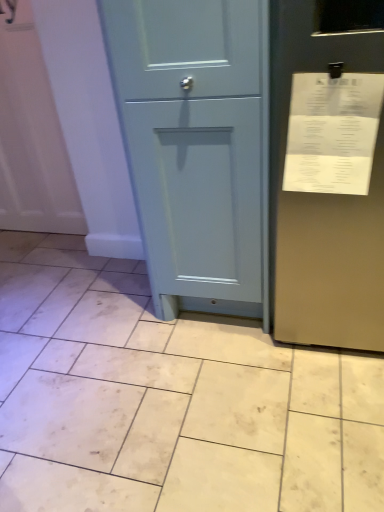
What do you see at coordinates (170, 402) in the screenshot? I see `beige matte tile at center, the 1th ceramic tile from the bottom` at bounding box center [170, 402].

Where is `white glossy tile at lower left, acting as the second ceramic tile starting from the bottom`? white glossy tile at lower left, acting as the second ceramic tile starting from the bottom is located at coordinates (18, 244).

Looking at this image, considering the relative sizes of white paper receipt at upper right and matte blue cabinet at center in the image provided, is white paper receipt at upper right smaller than matte blue cabinet at center?

Correct, white paper receipt at upper right occupies less space than matte blue cabinet at center.

From a real-world perspective, is white paper receipt at upper right physically above matte blue cabinet at center?

Yes, from a real-world perspective, white paper receipt at upper right is above matte blue cabinet at center.

Measure the distance between white paper receipt at upper right and matte blue cabinet at center.

A distance of 30.82 centimeters exists between white paper receipt at upper right and matte blue cabinet at center.

From the picture: Is white paper receipt at upper right far away from matte blue cabinet at center?

That's not correct — white paper receipt at upper right is a little close to matte blue cabinet at center.

Between point (291, 499) and point (133, 57), which one is positioned in front?

Positioned in front is point (291, 499).

Identify the location of door behind the beige matte tile at center, the 1th ceramic tile from the bottom. (197, 145).

Is beige matte tile at center, the 1th ceramic tile from the bottom, inside or outside of matte blue cabinet at center?

beige matte tile at center, the 1th ceramic tile from the bottom, is located beyond the bounds of matte blue cabinet at center.

From a real-world perspective, is beige matte tile at center, the 1th ceramic tile from the bottom, physically above matte blue cabinet at center?

Incorrect, from a real-world perspective, beige matte tile at center, the 1th ceramic tile from the bottom, is lower than matte blue cabinet at center.

From the image's perspective, which is below, matte blue cabinet at center or white glossy tile at lower left, acting as the second ceramic tile starting from the bottom?

white glossy tile at lower left, acting as the second ceramic tile starting from the bottom, is shown below in the image.

What's the angular difference between matte blue cabinet at center and white glossy tile at lower left, acting as the second ceramic tile starting from the bottom,'s facing directions?

The angular difference between matte blue cabinet at center and white glossy tile at lower left, acting as the second ceramic tile starting from the bottom, is 0.049 degrees.

Choose the correct answer: Is matte blue cabinet at center inside white glossy tile at lower left, which is the 1th ceramic tile from top to bottom, or outside it?

matte blue cabinet at center exists outside the volume of white glossy tile at lower left, which is the 1th ceramic tile from top to bottom.

Does matte blue cabinet at center have a lesser width compared to white glossy tile at lower left, which is the 1th ceramic tile from top to bottom?

Incorrect, the width of matte blue cabinet at center is not less than that of white glossy tile at lower left, which is the 1th ceramic tile from top to bottom.

Is point (154, 350) in front of point (36, 238)?

Yes, point (154, 350) is closer to viewer.

How much distance is there between beige matte tile at center, the 1th ceramic tile from the bottom, and white glossy tile at lower left, which is the 1th ceramic tile from top to bottom?

They are 3.77 feet apart.

Could you tell me if beige matte tile at center, the 1th ceramic tile from the bottom, is facing white glossy tile at lower left, acting as the second ceramic tile starting from the bottom?

No.

Considering the relative sizes of beige matte tile at center, which is counted as the second ceramic tile, starting from the top, and white glossy tile at lower left, acting as the second ceramic tile starting from the bottom, in the image provided, is beige matte tile at center, which is counted as the second ceramic tile, starting from the top, bigger than white glossy tile at lower left, acting as the second ceramic tile starting from the bottom,?

Yes.

Is white paper receipt at upper right looking in the opposite direction of beige matte tile at center, the 1th ceramic tile from the bottom?

No, white paper receipt at upper right's orientation is not away from beige matte tile at center, the 1th ceramic tile from the bottom.

From a real-world perspective, who is located lower, white paper receipt at upper right or beige matte tile at center, the 1th ceramic tile from the bottom?

In real-world perspective, beige matte tile at center, the 1th ceramic tile from the bottom, is lower.

From a real-world perspective, which ceramic tile is the 1st one underneath the white paper receipt at upper right? Please provide its 2D coordinates.

[(170, 402)]

Is white paper receipt at upper right positioned beyond the bounds of beige matte tile at center, which is counted as the second ceramic tile, starting from the top?

Yes, white paper receipt at upper right is located beyond the bounds of beige matte tile at center, which is counted as the second ceramic tile, starting from the top.

From a real-world perspective, is matte blue cabinet at center above or below white paper receipt at upper right?

matte blue cabinet at center is below white paper receipt at upper right.

Does point (168, 111) appear closer or farther from the camera than point (341, 105)?

Point (168, 111).

Considering the positions of objects matte blue cabinet at center and white paper receipt at upper right in the image provided, who is in front, matte blue cabinet at center or white paper receipt at upper right?

Positioned in front is white paper receipt at upper right.

The height and width of the screenshot is (512, 384). In the image, there is a white paper receipt at upper right. What are the coordinates of `door below it (from a real-world perspective)` in the screenshot? It's located at (197, 145).

Based on the photo, can you confirm if beige matte tile at center, which is counted as the second ceramic tile, starting from the top, is wider than white paper receipt at upper right?

Yes.

Would you say beige matte tile at center, which is counted as the second ceramic tile, starting from the top, is inside or outside white paper receipt at upper right?

beige matte tile at center, which is counted as the second ceramic tile, starting from the top, is not enclosed by white paper receipt at upper right.

The height and width of the screenshot is (512, 384). Find the location of `ceramic tile located in front of the white paper receipt at upper right`. ceramic tile located in front of the white paper receipt at upper right is located at coordinates (170, 402).

Where is `receipt above the matte blue cabinet at center (from a real-world perspective)`? This screenshot has height=512, width=384. receipt above the matte blue cabinet at center (from a real-world perspective) is located at coordinates (332, 132).

This screenshot has height=512, width=384. Identify the location of door on the right of the beige matte tile at center, which is counted as the second ceramic tile, starting from the top. (197, 145).

Which object lies further to the anchor point white paper receipt at upper right, matte blue cabinet at center or white glossy tile at lower left, which is the 1th ceramic tile from top to bottom?

white glossy tile at lower left, which is the 1th ceramic tile from top to bottom, is positioned further to the anchor white paper receipt at upper right.

Estimate the real-world distances between objects in this image. Which object is closer to white glossy tile at lower left, which is the 1th ceramic tile from top to bottom, white paper receipt at upper right or beige matte tile at center, the 1th ceramic tile from the bottom?

beige matte tile at center, the 1th ceramic tile from the bottom, is positioned closer to the anchor white glossy tile at lower left, which is the 1th ceramic tile from top to bottom.

Considering their positions, is beige matte tile at center, the 1th ceramic tile from the bottom, positioned further to white glossy tile at lower left, which is the 1th ceramic tile from top to bottom, than matte blue cabinet at center?

matte blue cabinet at center.

Consider the image. Looking at the image, which one is located further to matte blue cabinet at center, white glossy tile at lower left, acting as the second ceramic tile starting from the bottom, or beige matte tile at center, the 1th ceramic tile from the bottom?

white glossy tile at lower left, acting as the second ceramic tile starting from the bottom, is positioned further to the anchor matte blue cabinet at center.

When comparing their distances from beige matte tile at center, which is counted as the second ceramic tile, starting from the top, does white paper receipt at upper right or matte blue cabinet at center seem further?

The object further to beige matte tile at center, which is counted as the second ceramic tile, starting from the top, is white paper receipt at upper right.

Which object lies further to the anchor point white paper receipt at upper right, matte blue cabinet at center or beige matte tile at center, the 1th ceramic tile from the bottom?

Based on the image, beige matte tile at center, the 1th ceramic tile from the bottom, appears to be further to white paper receipt at upper right.

Considering their positions, is matte blue cabinet at center positioned closer to white glossy tile at lower left, which is the 1th ceramic tile from top to bottom, than white paper receipt at upper right?

matte blue cabinet at center is closer to white glossy tile at lower left, which is the 1th ceramic tile from top to bottom.

Considering their positions, is matte blue cabinet at center positioned further to beige matte tile at center, which is counted as the second ceramic tile, starting from the top, than white paper receipt at upper right?

Based on the image, white paper receipt at upper right appears to be further to beige matte tile at center, which is counted as the second ceramic tile, starting from the top.

Locate an element on the screen. Image resolution: width=384 pixels, height=512 pixels. door between white paper receipt at upper right and white glossy tile at lower left, acting as the second ceramic tile starting from the bottom, along the z-axis is located at coordinates (197, 145).

I want to click on receipt that lies between matte blue cabinet at center and beige matte tile at center, the 1th ceramic tile from the bottom, from top to bottom, so click(x=332, y=132).

The height and width of the screenshot is (512, 384). I want to click on receipt between beige matte tile at center, the 1th ceramic tile from the bottom, and white glossy tile at lower left, which is the 1th ceramic tile from top to bottom, in the front-back direction, so click(x=332, y=132).

The width and height of the screenshot is (384, 512). What are the coordinates of `door positioned between beige matte tile at center, the 1th ceramic tile from the bottom, and white glossy tile at lower left, which is the 1th ceramic tile from top to bottom, from near to far` in the screenshot? It's located at [x=197, y=145].